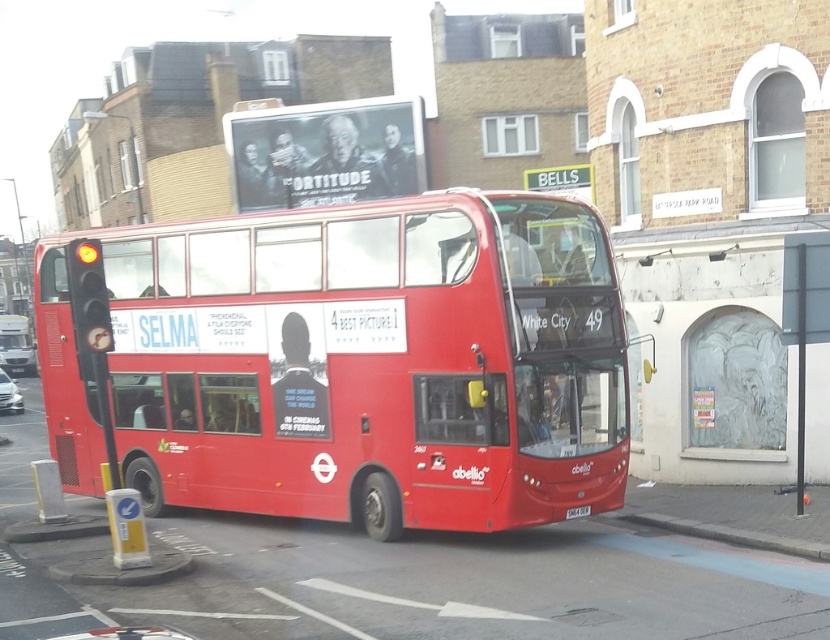
You are a pedestrian standing at the crosswalk. You see a metallic pole at center and a matte red bus at center. Which object is smaller in size?

The metallic pole at center is smaller than the matte red bus at center.

You are a pedestrian standing at the point marked by the coordinates (804,317). You want to cross the street to reach the red double decker bus parked at the traffic light. Is there an obstacle directly in your path?

The point (804,317) corresponds to a metallic pole at center, so yes, there is an obstacle directly in your path because the metallic pole at center is located where you are standing.